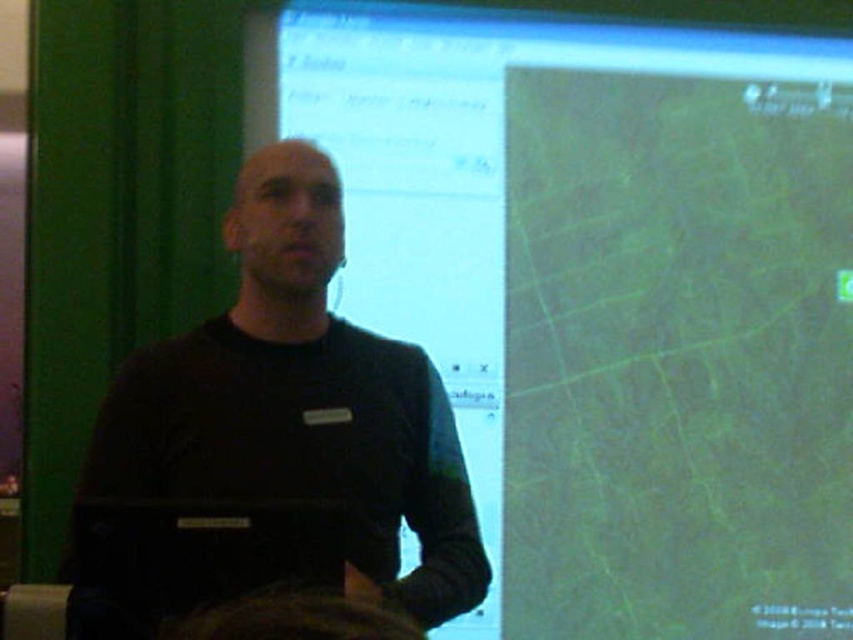
You are a GUI agent. You are given a task and a screenshot of the screen. Output one action in this format:
    pyautogui.click(x=<x>, y=<y>)
    Task: Click on the green matte map at center
    This screenshot has width=853, height=640.
    Given the screenshot: What is the action you would take?
    pyautogui.click(x=610, y=301)

Is green matte map at center in front of black matte laptop at center?

No.

Identify the location of green matte map at center. (610, 301).